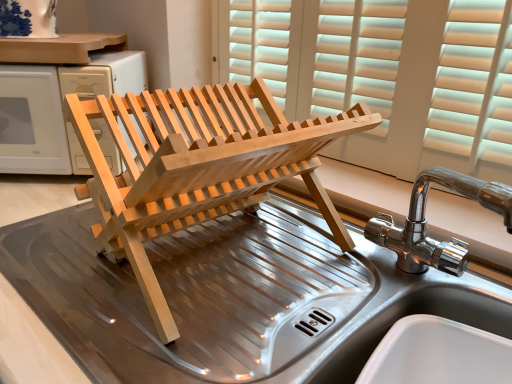
Question: Is stainless steel sink at center positioned with its back to natural wood dish rack at center?

Choices:
 (A) no
 (B) yes

Answer: (A)

Question: Can you confirm if stainless steel sink at center is positioned to the right of natural wood dish rack at center?

Choices:
 (A) yes
 (B) no

Answer: (A)

Question: Considering the relative sizes of stainless steel sink at center and natural wood dish rack at center in the image provided, is stainless steel sink at center bigger than natural wood dish rack at center?

Choices:
 (A) no
 (B) yes

Answer: (A)

Question: Does stainless steel sink at center have a greater width compared to natural wood dish rack at center?

Choices:
 (A) yes
 (B) no

Answer: (B)

Question: Does stainless steel sink at center have a lesser height compared to natural wood dish rack at center?

Choices:
 (A) no
 (B) yes

Answer: (B)

Question: Based on their positions, is natural wood dish rack at center located to the left or right of stainless steel sink at center?

Choices:
 (A) left
 (B) right

Answer: (A)

Question: Do you think natural wood dish rack at center is within stainless steel sink at center, or outside of it?

Choices:
 (A) inside
 (B) outside

Answer: (B)

Question: From a real-world perspective, relative to stainless steel sink at center, is natural wood dish rack at center vertically above or below?

Choices:
 (A) above
 (B) below

Answer: (B)

Question: Considering the positions of natural wood dish rack at center and stainless steel sink at center in the image, is natural wood dish rack at center wider or thinner than stainless steel sink at center?

Choices:
 (A) wide
 (B) thin

Answer: (A)

Question: Would you say natural wood dish rack at center is inside or outside chrome metallic tap at right?

Choices:
 (A) inside
 (B) outside

Answer: (B)

Question: From a real-world perspective, is natural wood dish rack at center physically located above or below chrome metallic tap at right?

Choices:
 (A) below
 (B) above

Answer: (A)

Question: Is natural wood dish rack at center taller or shorter than chrome metallic tap at right?

Choices:
 (A) short
 (B) tall

Answer: (B)

Question: Considering the positions of natural wood dish rack at center and chrome metallic tap at right in the image, is natural wood dish rack at center wider or thinner than chrome metallic tap at right?

Choices:
 (A) thin
 (B) wide

Answer: (B)

Question: From the image's perspective, relative to natural wood dish rack at center, is chrome metallic tap at right above or below?

Choices:
 (A) below
 (B) above

Answer: (A)

Question: From a real-world perspective, is chrome metallic tap at right positioned above or below natural wood dish rack at center?

Choices:
 (A) below
 (B) above

Answer: (A)